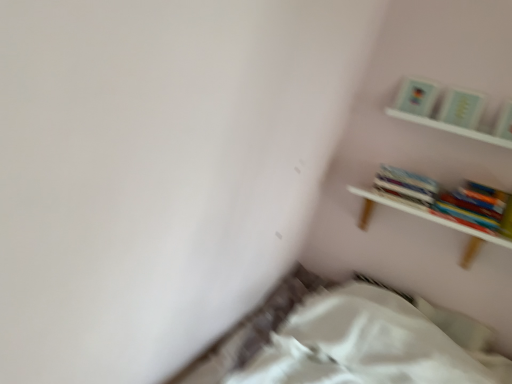
Question: From a real-world perspective, is matte paper at upper right, positioned as the 3th paperback book in right-to-left order, positioned above or below hardcover books at upper right?

Choices:
 (A) below
 (B) above

Answer: (B)

Question: From the image's perspective, is matte paper at upper right, positioned as the 3th paperback book in right-to-left order, above or below hardcover books at upper right?

Choices:
 (A) above
 (B) below

Answer: (A)

Question: Which object is the closest to the matte paper at upper right, which is the second paperback book from left to right?

Choices:
 (A) hardcover book at upper right, the 1th paperback book from the right
 (B) hardcover books at upper right
 (C) matte paper at upper right, positioned as the 3th paperback book in right-to-left order
 (D) white wooden shelf at upper right, which is counted as the second shelf, starting from the bottom
 (E) white wooden shelf at upper right, which is the first shelf from bottom to top

Answer: (D)

Question: Which of these objects is positioned closest to the matte paper at upper right, positioned as the 3th paperback book in right-to-left order?

Choices:
 (A) hardcover book at upper right, the 3th paperback book when ordered from left to right
 (B) matte paper at upper right, the 2th paperback book when ordered from right to left
 (C) hardcover books at upper right
 (D) white fabric bed at lower center
 (E) white wooden shelf at upper right, which is the first shelf from bottom to top

Answer: (B)